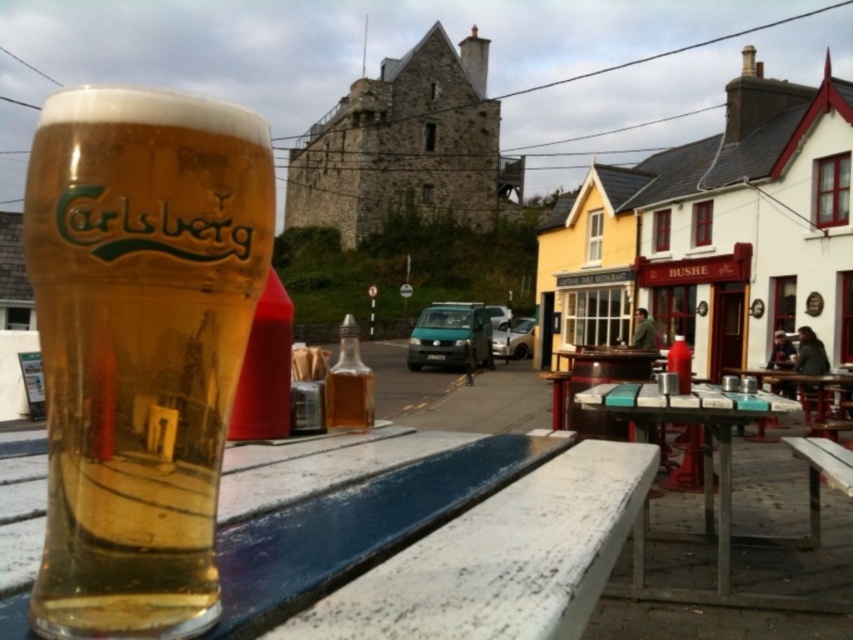
Does white painted wood table at lower center have a smaller size compared to white marble table at center?

Yes, white painted wood table at lower center is smaller than white marble table at center.

Does white painted wood table at lower center appear over white marble table at center?

Yes, white painted wood table at lower center is above white marble table at center.

Does point (407, 481) come in front of point (718, 516)?

That is True.

The image size is (853, 640). What are the coordinates of `white painted wood table at lower center` in the screenshot? It's located at (431, 541).

Locate an element on the screen. The height and width of the screenshot is (640, 853). golden glass carlsberg at left is located at coordinates (140, 346).

Measure the distance between golden glass carlsberg at left and translucent glass bottle at center.

golden glass carlsberg at left and translucent glass bottle at center are 3.91 meters apart.

Image resolution: width=853 pixels, height=640 pixels. What are the coordinates of `golden glass carlsberg at left` in the screenshot? It's located at click(x=140, y=346).

Is point (166, 518) closer to camera compared to point (374, 484)?

Yes, point (166, 518) is in front of point (374, 484).

Which of these two, golden glass carlsberg at left or white painted wood table at lower center, stands taller?

Standing taller between the two is golden glass carlsberg at left.

Does point (109, 326) lie in front of point (606, 566)?

Yes.

You are a GUI agent. You are given a task and a screenshot of the screen. Output one action in this format:
    pyautogui.click(x=<x>, y=<y>)
    Task: Click on the golden glass carlsberg at left
    This screenshot has width=853, height=640.
    Given the screenshot: What is the action you would take?
    tap(140, 346)